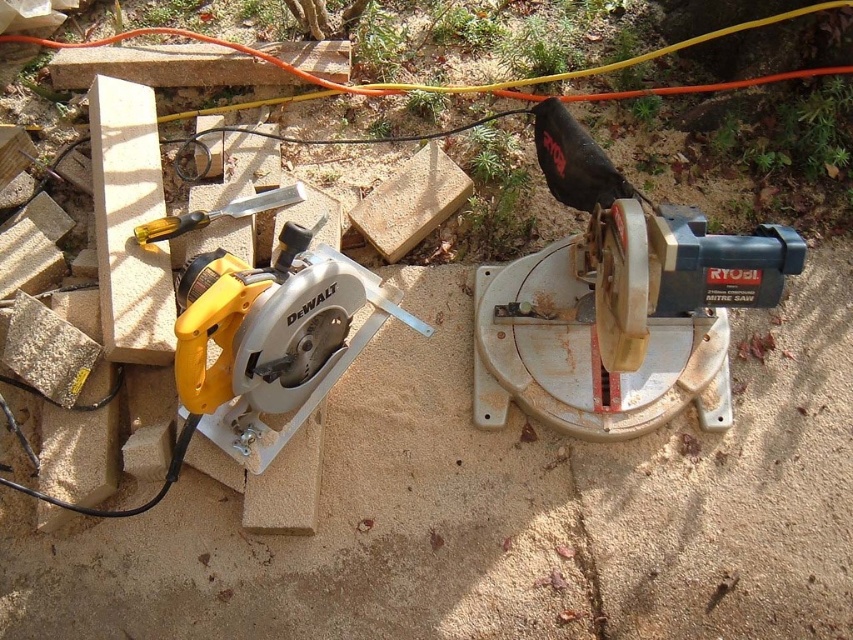
Locate an element on the screen. rusty metal mitre saw at center is located at coordinates (622, 321).

Can you confirm if rusty metal mitre saw at center is positioned to the left of yellow plastic circular saw at left?

In fact, rusty metal mitre saw at center is to the right of yellow plastic circular saw at left.

Measure the distance between rusty metal mitre saw at center and camera.

A distance of 4.36 feet exists between rusty metal mitre saw at center and camera.

Identify the location of rusty metal mitre saw at center. The image size is (853, 640). (622, 321).

Consider the image. Who is positioned more to the left, yellow plastic circular saw at left or yellow plastic-handled chisel at center-left?

From the viewer's perspective, yellow plastic-handled chisel at center-left appears more on the left side.

Is yellow plastic circular saw at left closer to camera compared to yellow plastic-handled chisel at center-left?

Yes.

The height and width of the screenshot is (640, 853). What are the coordinates of `yellow plastic circular saw at left` in the screenshot? It's located at (271, 339).

Locate an element on the screen. This screenshot has height=640, width=853. yellow plastic circular saw at left is located at coordinates (271, 339).

Can you confirm if rusty metal mitre saw at center is positioned below yellow plastic-handled chisel at center-left?

Yes.

Measure the distance between rusty metal mitre saw at center and camera.

rusty metal mitre saw at center is 1.33 meters away from camera.

Which is in front, point (532, 410) or point (171, 216)?

Positioned in front is point (532, 410).

I want to click on rusty metal mitre saw at center, so click(622, 321).